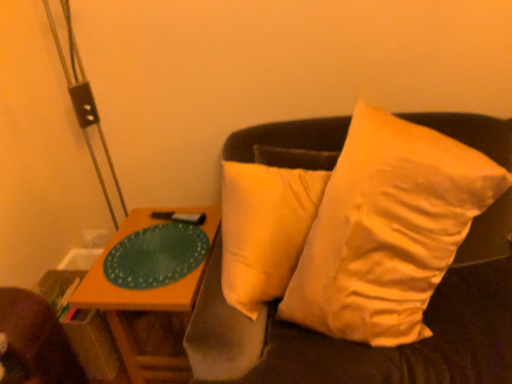
Question: Does wooden table at left turn towards white soft pillow at upper right?

Choices:
 (A) no
 (B) yes

Answer: (A)

Question: Is wooden table at left further to camera compared to white soft pillow at upper right?

Choices:
 (A) no
 (B) yes

Answer: (B)

Question: Considering the relative positions of wooden table at left and white soft pillow at upper right in the image provided, is wooden table at left to the right of white soft pillow at upper right from the viewer's perspective?

Choices:
 (A) yes
 (B) no

Answer: (B)

Question: Is wooden table at left smaller than white soft pillow at upper right?

Choices:
 (A) yes
 (B) no

Answer: (A)

Question: Can you confirm if wooden table at left is positioned to the left of white soft pillow at upper right?

Choices:
 (A) no
 (B) yes

Answer: (B)

Question: In the image, is wooden table at left positioned in front of or behind green matte glass plate at left?

Choices:
 (A) front
 (B) behind

Answer: (A)

Question: From a real-world perspective, is wooden table at left positioned above or below green matte glass plate at left?

Choices:
 (A) above
 (B) below

Answer: (B)

Question: Is wooden table at left spatially inside green matte glass plate at left, or outside of it?

Choices:
 (A) outside
 (B) inside

Answer: (A)

Question: Visually, is wooden table at left positioned to the left or to the right of green matte glass plate at left?

Choices:
 (A) left
 (B) right

Answer: (B)

Question: Is wooden table at left inside or outside of white soft pillow at upper right?

Choices:
 (A) outside
 (B) inside

Answer: (A)

Question: Considering their positions, is wooden table at left located in front of or behind white soft pillow at upper right?

Choices:
 (A) front
 (B) behind

Answer: (B)

Question: In terms of size, does wooden table at left appear bigger or smaller than white soft pillow at upper right?

Choices:
 (A) small
 (B) big

Answer: (A)

Question: Considering the positions of point (141, 309) and point (292, 314), is point (141, 309) closer or farther from the camera than point (292, 314)?

Choices:
 (A) farther
 (B) closer

Answer: (A)

Question: From the image's perspective, is white soft pillow at upper right above or below green matte glass plate at left?

Choices:
 (A) below
 (B) above

Answer: (B)

Question: Is white soft pillow at upper right to the left or to the right of green matte glass plate at left in the image?

Choices:
 (A) right
 (B) left

Answer: (A)